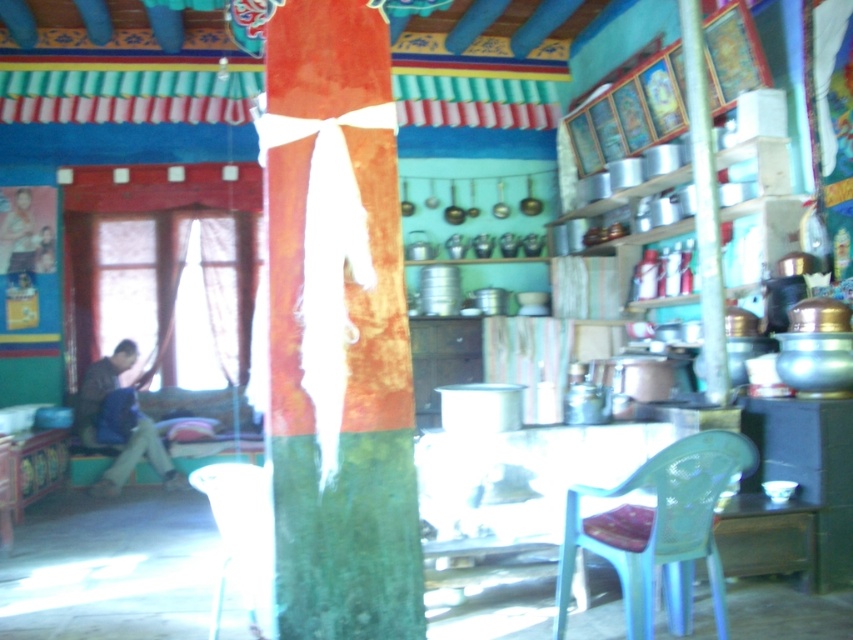
Question: Which point is farther from the camera taking this photo?

Choices:
 (A) (724, 488)
 (B) (247, 481)

Answer: (B)

Question: Observing the image, what is the correct spatial positioning of green felt tree trunk at center in reference to metallic pole at right?

Choices:
 (A) above
 (B) below

Answer: (B)

Question: Which object is the farthest from the transparent plastic chair at lower right?

Choices:
 (A) camouflage fabric shirt at left
 (B) green felt tree trunk at center
 (C) metallic pole at right

Answer: (A)

Question: Does green felt tree trunk at center have a greater width compared to camouflage fabric shirt at left?

Choices:
 (A) yes
 (B) no

Answer: (B)

Question: Can you confirm if green felt tree trunk at center is positioned to the left of transparent plastic chair at lower right?

Choices:
 (A) yes
 (B) no

Answer: (A)

Question: Estimate the real-world distances between objects in this image. Which object is closer to the translucent plastic chair at lower center?

Choices:
 (A) green felt tree trunk at center
 (B) transparent plastic chair at lower right
 (C) camouflage fabric shirt at left
 (D) metallic pole at right

Answer: (A)